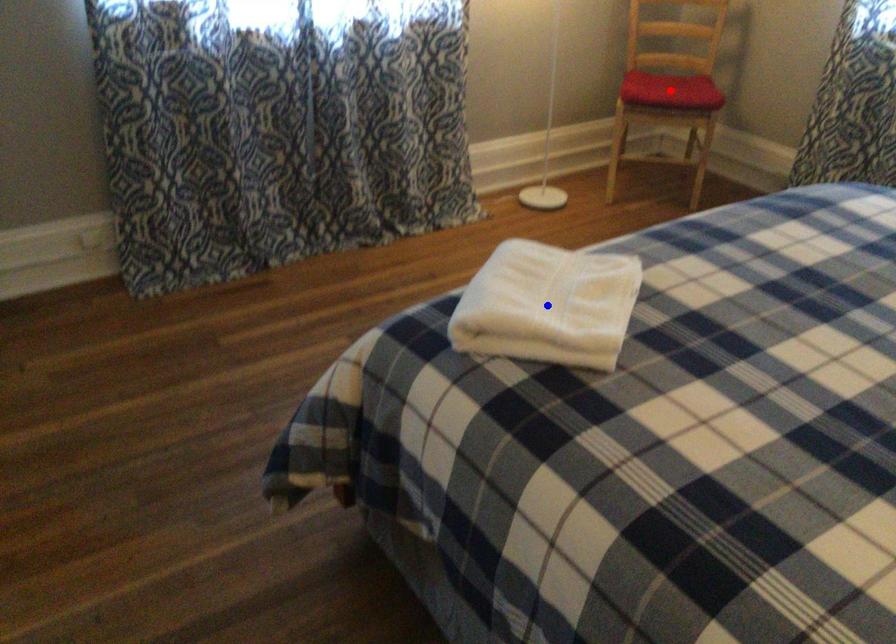
Question: Two points are marked on the image. Which point is closer to the camera?

Choices:
 (A) Blue point is closer.
 (B) Red point is closer.

Answer: (A)